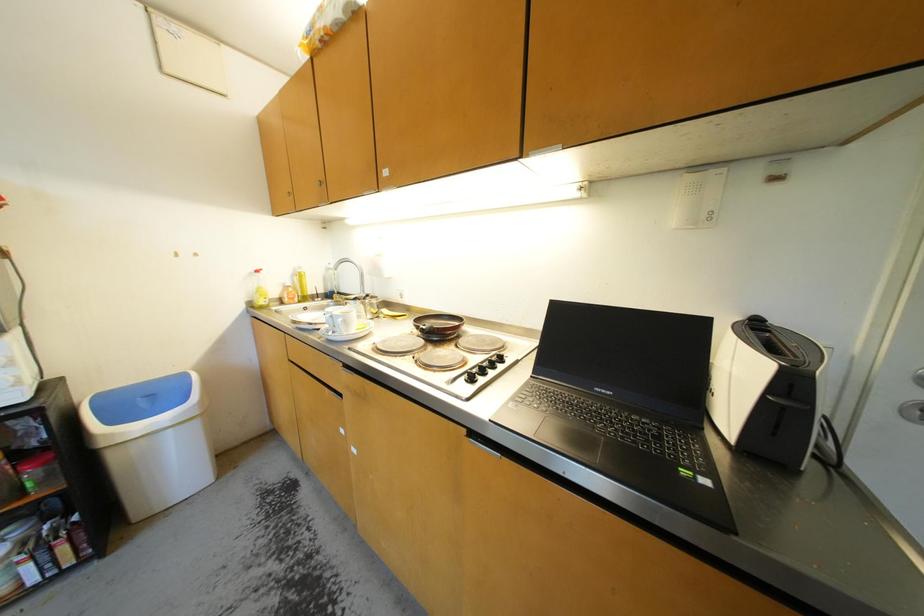
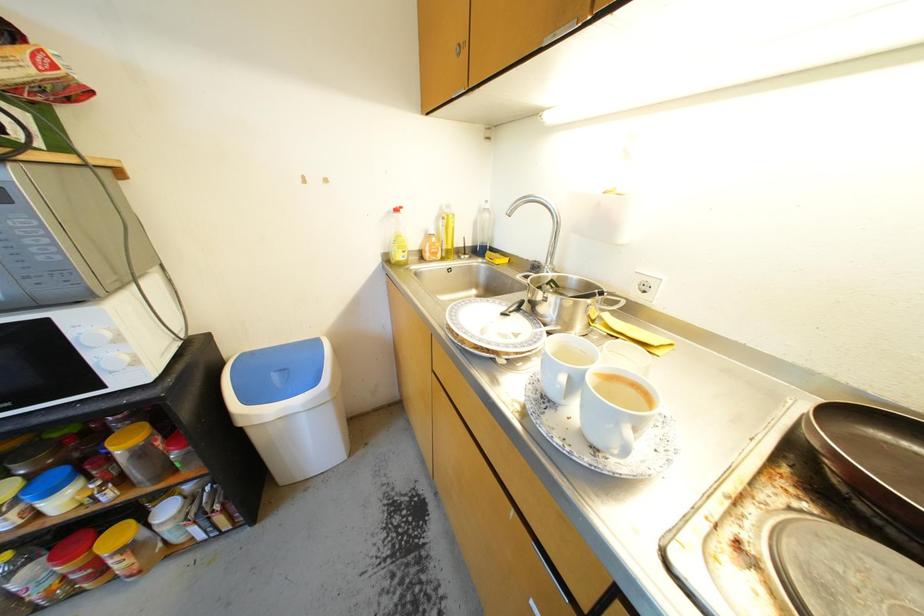
The images are taken continuously from a first-person perspective. In which direction are you moving?

The movement direction of the cameraman is left, forward.